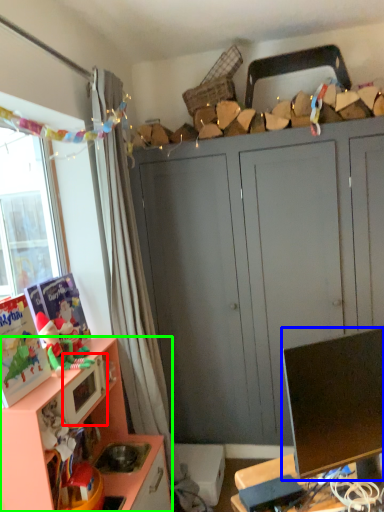
Question: Which object is the closest to the microwave oven (highlighted by a red box)? Choose among these: television (highlighted by a blue box) or cabinetry (highlighted by a green box).

Choices:
 (A) television
 (B) cabinetry

Answer: (B)